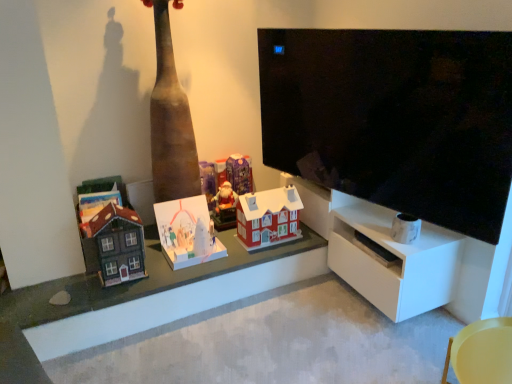
Where is `matte red plastic house at center, placed as the fifth toy when sorted from left to right`? matte red plastic house at center, placed as the fifth toy when sorted from left to right is located at coordinates tap(268, 217).

Measure the distance between point (x=246, y=240) and camera.

Point (x=246, y=240) and camera are 2.51 meters apart from each other.

From the picture: Measure the distance between yellow plastic chair at lower right and camera.

yellow plastic chair at lower right is 5.01 feet from camera.

Measure the distance between point (499, 363) and camera.

The distance of point (499, 363) from camera is 1.63 meters.

Locate an element on the screen. The height and width of the screenshot is (384, 512). white cardboard advent calendar at center, marked as the 4th toy in a right-to-left arrangement is located at coordinates (187, 232).

This screenshot has height=384, width=512. What do you see at coordinates (208, 181) in the screenshot?
I see `matte purple ornament at center, marked as the third toy in a right-to-left arrangement` at bounding box center [208, 181].

I want to click on matte brown wooden house at left, the first toy viewed from the left, so click(x=117, y=244).

Is black glossy tv at upper right wider or thinner than purple glossy advent calendar at center, the 4th toy when ordered from left to right?

Clearly, black glossy tv at upper right has less width compared to purple glossy advent calendar at center, the 4th toy when ordered from left to right.

Is black glossy tv at upper right in contact with purple glossy advent calendar at center, marked as the 2th toy in a right-to-left arrangement?

No.

From a real-world perspective, which is physically above, matte purple ornament at center, arranged as the third toy when viewed from the left, or white cardboard advent calendar at center, the 2th toy in the left-to-right sequence?

From a 3D spatial view, matte purple ornament at center, arranged as the third toy when viewed from the left, is above.

Consider the image. Considering the relative positions of matte purple ornament at center, arranged as the third toy when viewed from the left, and white cardboard advent calendar at center, marked as the 4th toy in a right-to-left arrangement, in the image provided, is matte purple ornament at center, arranged as the third toy when viewed from the left, in front of white cardboard advent calendar at center, marked as the 4th toy in a right-to-left arrangement,?

No, matte purple ornament at center, arranged as the third toy when viewed from the left, is further to the viewer.

From the image's perspective, which one is positioned lower, matte purple ornament at center, arranged as the third toy when viewed from the left, or white cardboard advent calendar at center, the 2th toy in the left-to-right sequence?

white cardboard advent calendar at center, the 2th toy in the left-to-right sequence.

Based on the photo, can you see matte purple ornament at center, marked as the third toy in a right-to-left arrangement, touching white cardboard advent calendar at center, marked as the 4th toy in a right-to-left arrangement?

There is a gap between matte purple ornament at center, marked as the third toy in a right-to-left arrangement, and white cardboard advent calendar at center, marked as the 4th toy in a right-to-left arrangement.

From the image's perspective, which one is positioned higher, white cardboard advent calendar at center, marked as the 4th toy in a right-to-left arrangement, or white matte shelf at right?

From the image's view, white cardboard advent calendar at center, marked as the 4th toy in a right-to-left arrangement, is above.

Between point (174, 261) and point (399, 250), which one is positioned in front?

The point (399, 250) is closer to the camera.

From a real-world perspective, which object rests below the other?

From a 3D spatial view, white matte shelf at right is below.

Which object is thinner, white cardboard advent calendar at center, the 2th toy in the left-to-right sequence, or white matte shelf at right?

white cardboard advent calendar at center, the 2th toy in the left-to-right sequence, is thinner.

In the scene shown: Does white matte shelf at right lie behind matte purple ornament at center, arranged as the third toy when viewed from the left?

That is False.

Does point (432, 247) appear closer or farther from the camera than point (209, 178)?

Clearly, point (432, 247) is closer to the camera than point (209, 178).

Does white matte shelf at right have a larger size compared to matte purple ornament at center, arranged as the third toy when viewed from the left?

Yes, white matte shelf at right is bigger than matte purple ornament at center, arranged as the third toy when viewed from the left.

Can you confirm if white matte shelf at right is thinner than matte purple ornament at center, marked as the third toy in a right-to-left arrangement?

In fact, white matte shelf at right might be wider than matte purple ornament at center, marked as the third toy in a right-to-left arrangement.

Can you confirm if yellow plastic chair at lower right is taller than wooden toy houses at center?

Yes, yellow plastic chair at lower right is taller than wooden toy houses at center.

In the scene shown: Is yellow plastic chair at lower right next to wooden toy houses at center and touching it?

No, yellow plastic chair at lower right is not next to wooden toy houses at center.

Is point (492, 331) in front of point (207, 292)?

That is True.

From a real-world perspective, is matte red plastic house at center, placed as the fifth toy when sorted from left to right, physically above wooden toy houses at center?

Yes, from a real-world perspective, matte red plastic house at center, placed as the fifth toy when sorted from left to right, is on top of wooden toy houses at center.

Does matte red plastic house at center, the first toy from the right, lie in front of wooden toy houses at center?

No, matte red plastic house at center, the first toy from the right, is further to the viewer.

From the image's perspective, is matte red plastic house at center, the first toy from the right, above or below wooden toy houses at center?

From the image's perspective, matte red plastic house at center, the first toy from the right, appears above wooden toy houses at center.

How many degrees apart are the facing directions of matte red plastic house at center, placed as the fifth toy when sorted from left to right, and wooden toy houses at center?

0.884 degrees separate the facing orientations of matte red plastic house at center, placed as the fifth toy when sorted from left to right, and wooden toy houses at center.

Is there a large distance between matte purple ornament at center, arranged as the third toy when viewed from the left, and black glossy tv at upper right?

Absolutely, matte purple ornament at center, arranged as the third toy when viewed from the left, is distant from black glossy tv at upper right.

Would you say matte purple ornament at center, marked as the third toy in a right-to-left arrangement, is inside or outside black glossy tv at upper right?

matte purple ornament at center, marked as the third toy in a right-to-left arrangement, cannot be found inside black glossy tv at upper right.

Can you confirm if matte purple ornament at center, arranged as the third toy when viewed from the left, is taller than black glossy tv at upper right?

No, matte purple ornament at center, arranged as the third toy when viewed from the left, is not taller than black glossy tv at upper right.

Where is `television above the purple glossy advent calendar at center, the 4th toy when ordered from left to right (from a real-world perspective)`? The height and width of the screenshot is (384, 512). television above the purple glossy advent calendar at center, the 4th toy when ordered from left to right (from a real-world perspective) is located at coordinates (394, 119).

Where is `the 3rd toy in front of the matte purple ornament at center, arranged as the third toy when viewed from the left`? The width and height of the screenshot is (512, 384). the 3rd toy in front of the matte purple ornament at center, arranged as the third toy when viewed from the left is located at coordinates (187, 232).

Which object lies further to the anchor point wooden toy houses at center, white cardboard advent calendar at center, the 2th toy in the left-to-right sequence, or yellow plastic chair at lower right?

yellow plastic chair at lower right is further to wooden toy houses at center.

Which object lies further to the anchor point matte red plastic house at center, placed as the fifth toy when sorted from left to right, white cardboard advent calendar at center, the 2th toy in the left-to-right sequence, or purple glossy advent calendar at center, the 4th toy when ordered from left to right?

Among the two, purple glossy advent calendar at center, the 4th toy when ordered from left to right, is located further to matte red plastic house at center, placed as the fifth toy when sorted from left to right.

Estimate the real-world distances between objects in this image. Which object is further from black glossy tv at upper right, matte brown wooden house at left, which appears as the 5th toy when viewed from the right, or white cardboard advent calendar at center, marked as the 4th toy in a right-to-left arrangement?

The object further to black glossy tv at upper right is matte brown wooden house at left, which appears as the 5th toy when viewed from the right.

Looking at the image, which one is located closer to wooden toy houses at center, black glossy tv at upper right or matte brown wooden house at left, which appears as the 5th toy when viewed from the right?

matte brown wooden house at left, which appears as the 5th toy when viewed from the right, is closer to wooden toy houses at center.

Estimate the real-world distances between objects in this image. Which object is further from purple glossy advent calendar at center, the 4th toy when ordered from left to right, white matte shelf at right or matte brown wooden house at left, the first toy viewed from the left?

white matte shelf at right is positioned further to the anchor purple glossy advent calendar at center, the 4th toy when ordered from left to right.

Which object lies nearer to the anchor point white cardboard advent calendar at center, marked as the 4th toy in a right-to-left arrangement, matte brown wooden house at left, which appears as the 5th toy when viewed from the right, or white matte shelf at right?

matte brown wooden house at left, which appears as the 5th toy when viewed from the right, is closer to white cardboard advent calendar at center, marked as the 4th toy in a right-to-left arrangement.

Consider the image. Estimate the real-world distances between objects in this image. Which object is further from wooden toy houses at center, matte brown wooden house at left, the first toy viewed from the left, or yellow plastic chair at lower right?

yellow plastic chair at lower right.

Based on the photo, from the image, which object appears to be farther from purple glossy advent calendar at center, the 4th toy when ordered from left to right, white matte shelf at right or matte red plastic house at center, the first toy from the right?

white matte shelf at right lies further to purple glossy advent calendar at center, the 4th toy when ordered from left to right, than the other object.

I want to click on toy between wooden toy houses at center and white cardboard advent calendar at center, the 2th toy in the left-to-right sequence, from front to back, so click(x=117, y=244).

You are a GUI agent. You are given a task and a screenshot of the screen. Output one action in this format:
    pyautogui.click(x=<x>, y=<y>)
    Task: Click on the television between white cardboard advent calendar at center, marked as the 4th toy in a right-to-left arrangement, and yellow plastic chair at lower right
    The image size is (512, 384).
    Given the screenshot: What is the action you would take?
    click(394, 119)

In order to click on toy between matte red plastic house at center, the first toy from the right, and matte purple ornament at center, arranged as the third toy when viewed from the left, along the z-axis in this screenshot , I will do `click(239, 173)`.

Find the location of `table between matte brown wooden house at left, which appears as the 5th toy when viewed from the right, and black glossy tv at upper right, in the horizontal direction`. table between matte brown wooden house at left, which appears as the 5th toy when viewed from the right, and black glossy tv at upper right, in the horizontal direction is located at coordinates (164, 293).